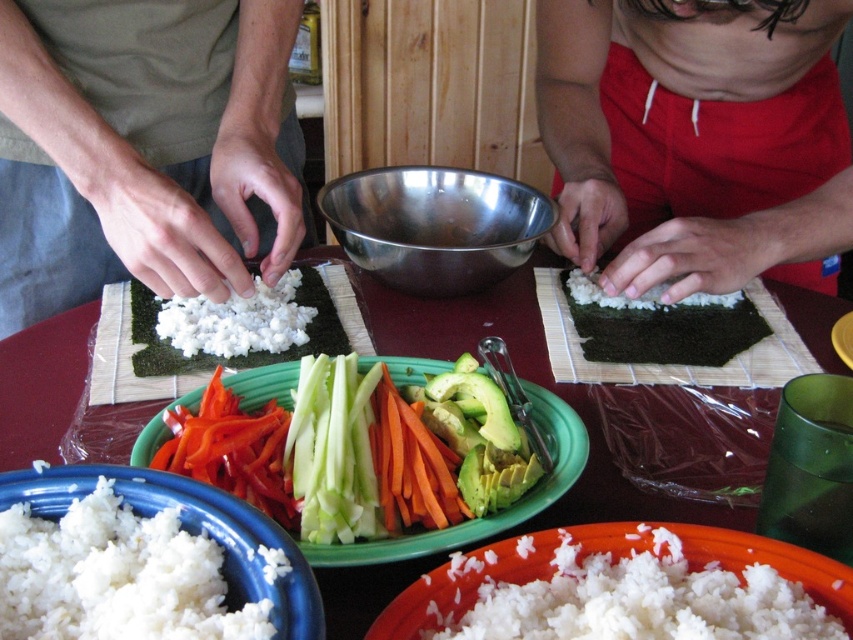
Question: Estimate the real-world distances between objects in this image. Which object is farther from the white matte rice at lower left?

Choices:
 (A) white matte rice at lower center
 (B) orange sliced carrot at center
 (C) matte red shorts at center right

Answer: (C)

Question: Can you confirm if metallic silver bowl at center is thinner than orange smooth carrot at lower left?

Choices:
 (A) yes
 (B) no

Answer: (B)

Question: Which object is the farthest from the green crisp cucumber at center?

Choices:
 (A) smooth green platter at center
 (B) green avocado at center

Answer: (B)

Question: Is the position of green crisp cucumber at center more distant than that of orange sliced carrot at center?

Choices:
 (A) no
 (B) yes

Answer: (A)

Question: Does white matte rice at center appear on the left side of white matte rice at lower left?

Choices:
 (A) no
 (B) yes

Answer: (B)

Question: Based on their relative distances, which object is nearer to the smooth green platter at center?

Choices:
 (A) orange sliced carrot at center
 (B) white matte rice at center
 (C) marble table at center

Answer: (A)